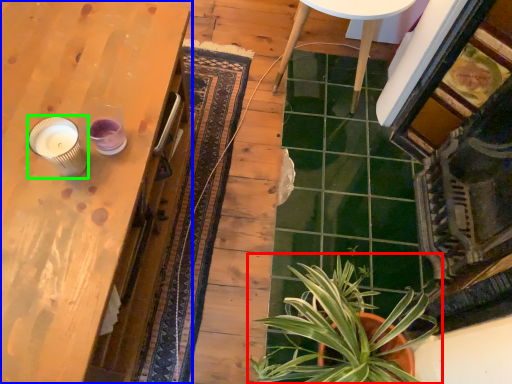
Question: Which is nearer to the houseplant (highlighted by a red box)? table (highlighted by a blue box) or candle holder (highlighted by a green box).

Choices:
 (A) table
 (B) candle holder

Answer: (A)